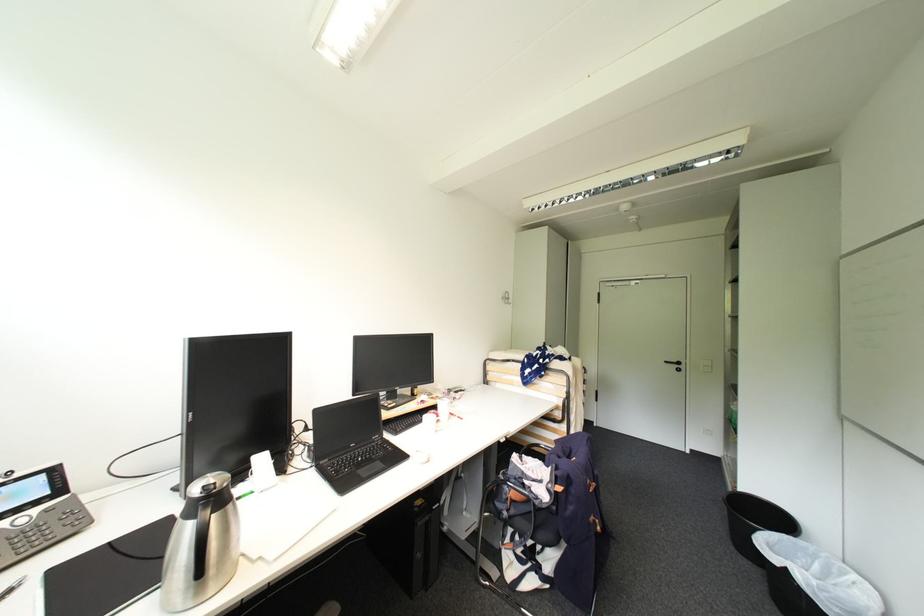
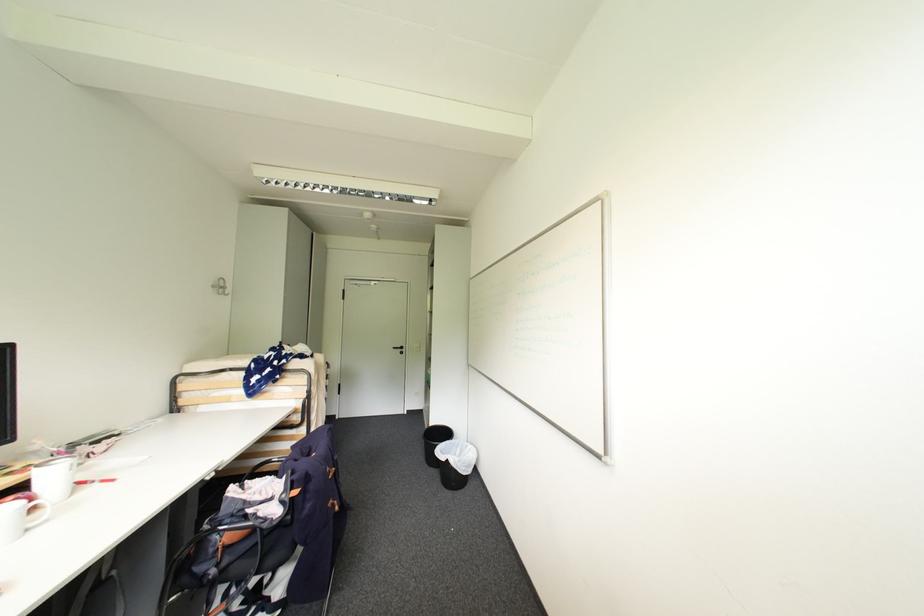
The point at (450, 406) is marked in the first image. Where is the corresponding point in the second image?

(58, 475)